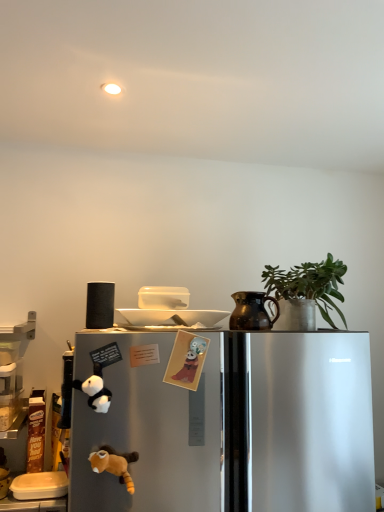
Question: Visually, is satin silver refrigerator at center positioned to the left or to the right of brown matte jug at upper right?

Choices:
 (A) left
 (B) right

Answer: (A)

Question: From the image's perspective, relative to brown matte jug at upper right, is satin silver refrigerator at center above or below?

Choices:
 (A) above
 (B) below

Answer: (B)

Question: Estimate the real-world distances between objects in this image. Which object is farther from the satin silver refrigerator at center?

Choices:
 (A) brown matte jug at upper right
 (B) white plastic container at lower left
 (C) orange plush toy at lower left
 (D) green matte plant at upper right

Answer: (B)

Question: Which is nearer to the green matte plant at upper right?

Choices:
 (A) satin silver refrigerator at center
 (B) brown matte jug at upper right
 (C) orange plush toy at lower left
 (D) white plastic container at lower left

Answer: (B)